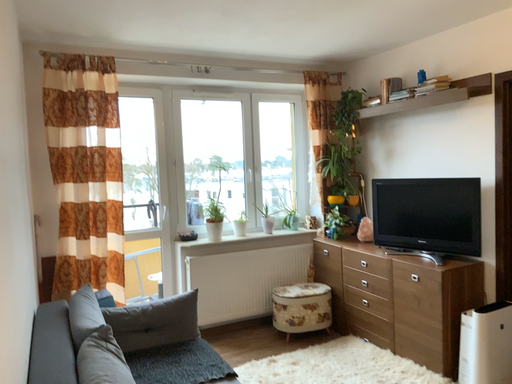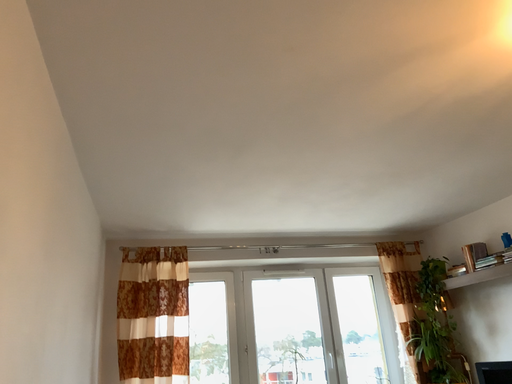
Question: Which way did the camera rotate in the video?

Choices:
 (A) rotated left
 (B) rotated right

Answer: (A)